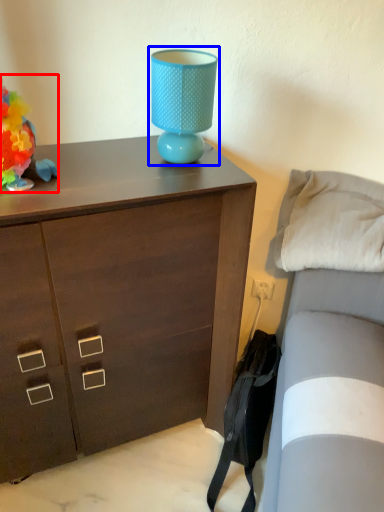
Question: Which object is further to the camera taking this photo, toy (highlighted by a red box) or table lamp (highlighted by a blue box)?

Choices:
 (A) toy
 (B) table lamp

Answer: (B)